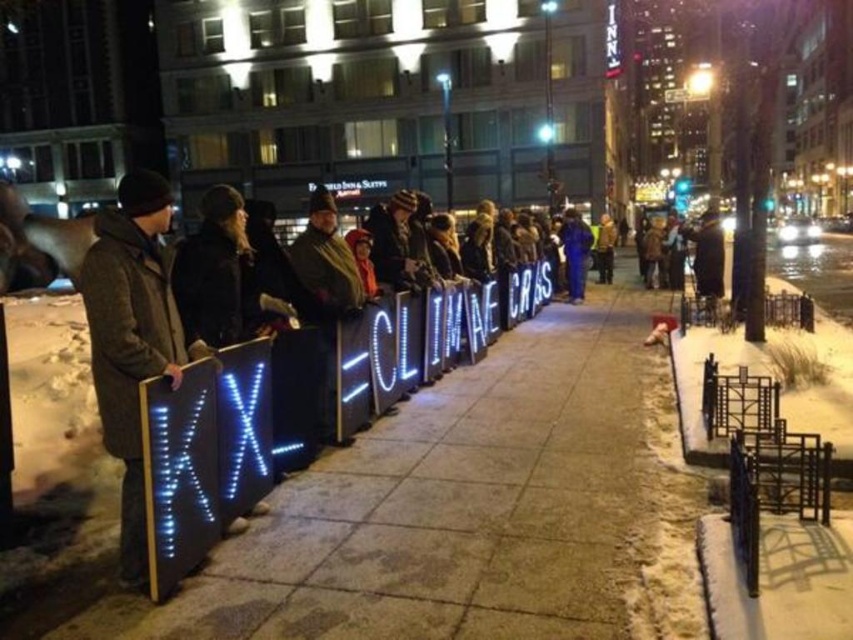
You are a photographer standing at the center of the sidewalk in the image. You want to take a photo of the dark gray wool coat at left. Where should you position yourself to capture it in the frame?

To capture the dark gray wool coat at left in the frame, position yourself so that your camera is aimed towards the coordinates point [132,337] where the dark gray wool coat at left is located.

You are a city planner analyzing the layout of this protest scene. Based on the coordinates provided, where exactly is the concrete sidewalk at center located in the image?

The concrete sidewalk at center is located at the 2D coordinates point [440,513].

You are a photographer trying to capture the entire group holding the signs. You notice the concrete sidewalk at center and the brown leather jacket at center in your frame. Which object should you focus on to ensure the other fits into the shot?

Since the concrete sidewalk at center is smaller than the brown leather jacket at center, you should focus on the brown leather jacket at center to ensure the smaller sidewalk fits into the shot.